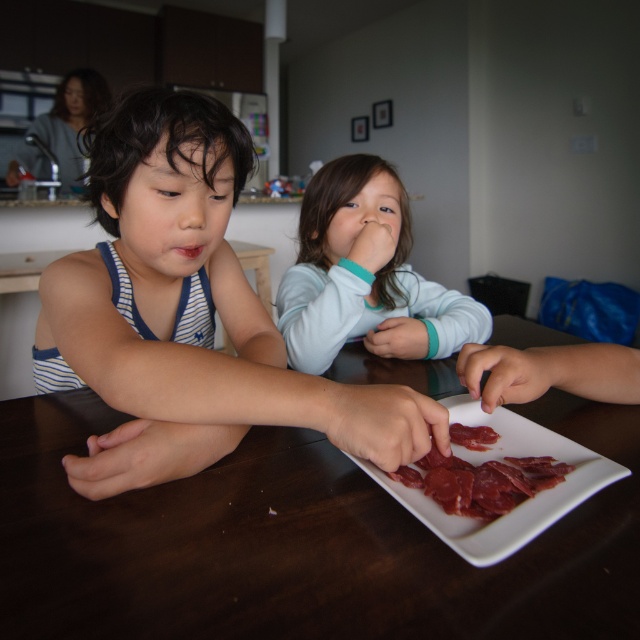
Where is `blue striped tank top at left`? blue striped tank top at left is located at coordinates (186, 314).

Which is in front, point (134, 125) or point (323, 168)?

Point (134, 125)

Does point (333, 426) come in front of point (470, 333)?

Yes, it is in front of point (470, 333).

Find the location of a particular element. The width and height of the screenshot is (640, 640). blue striped tank top at left is located at coordinates (186, 314).

Is blue striped tank top at left wider than dried meat at center?

Indeed, blue striped tank top at left has a greater width compared to dried meat at center.

Can you confirm if blue striped tank top at left is positioned to the right of dried meat at center?

Incorrect, blue striped tank top at left is not on the right side of dried meat at center.

Is point (124, 465) behind point (492, 477)?

Yes, point (124, 465) is behind point (492, 477).

Identify the location of blue striped tank top at left. (186, 314).

Consider the image. Is brown wooden table at center taller than smooth white shirt at center?

No, brown wooden table at center is not taller than smooth white shirt at center.

Is brown wooden table at center smaller than smooth white shirt at center?

Incorrect, brown wooden table at center is not smaller in size than smooth white shirt at center.

Who is more forward, (344, 529) or (362, 317)?

Point (344, 529) is in front.

The image size is (640, 640). What are the coordinates of `brown wooden table at center` in the screenshot? It's located at (296, 541).